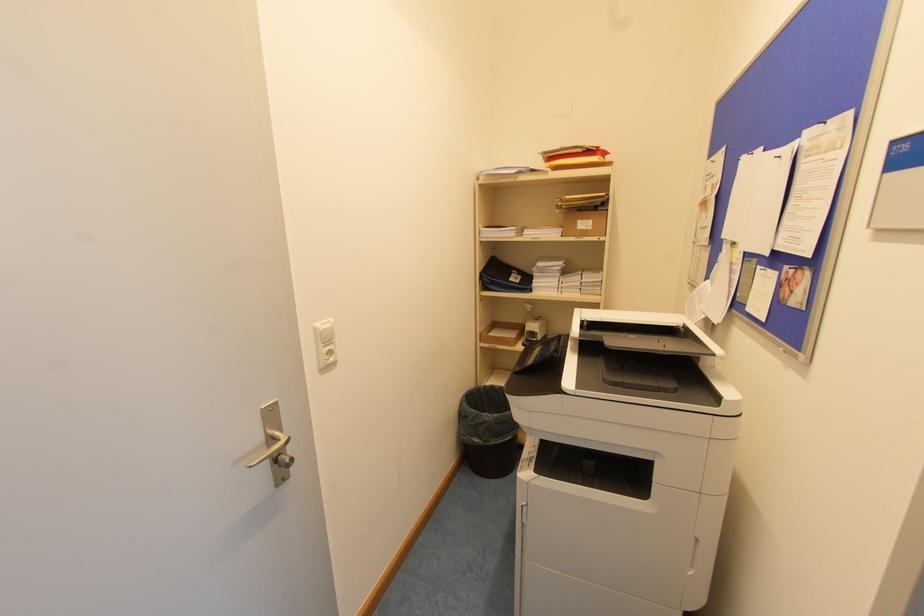
Identify the location of small cardboard box. (584, 224).